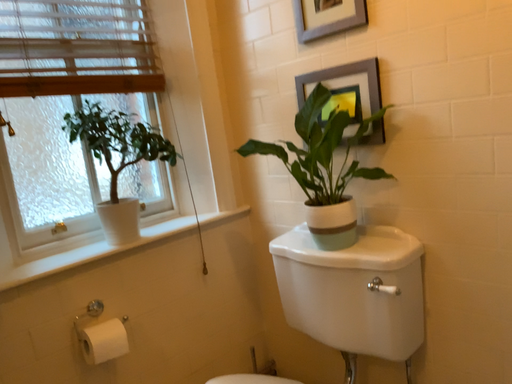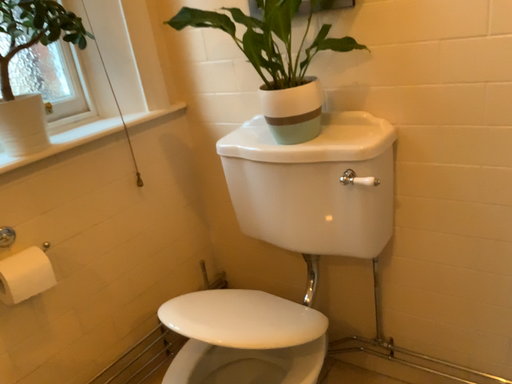
Question: Which way did the camera rotate in the video?

Choices:
 (A) rotated downward
 (B) rotated upward

Answer: (A)